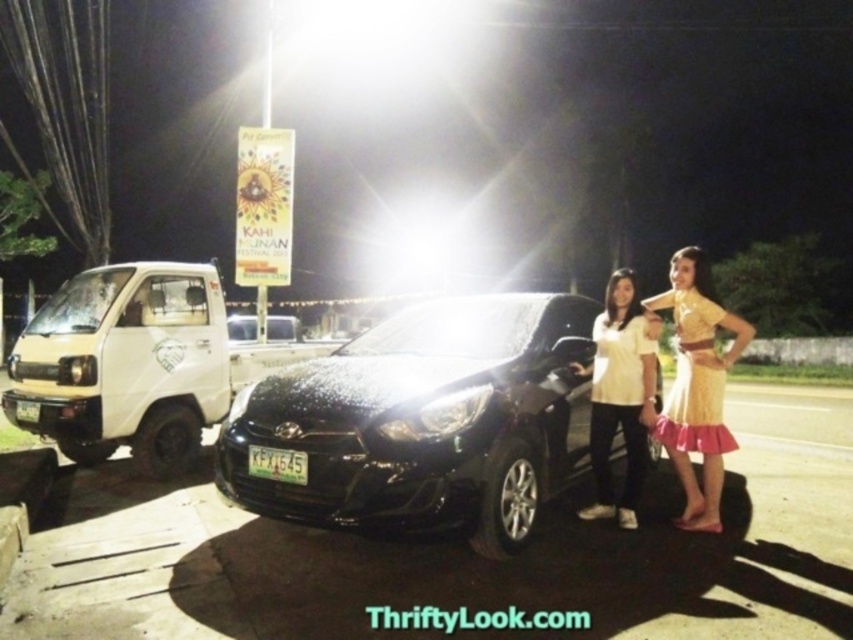
You are standing in the nighttime scene and want to walk from the closer point to the farther point. Which direction should you face to move from point (376,378) to point (689,470)?

To move from the closer point (376,378) to the farther point (689,470), you should face towards the upper right direction since point (689,470) is farther away and located in that direction.

You are a photographer taking a nighttime photo and notice two people in the scene. One is wearing a yellow satin dress at right and the other a white matte shirt at center. Which clothing item takes up more space in the photo?

The yellow satin dress at right is bigger than the white matte shirt at center, so it takes up more space in the photo.